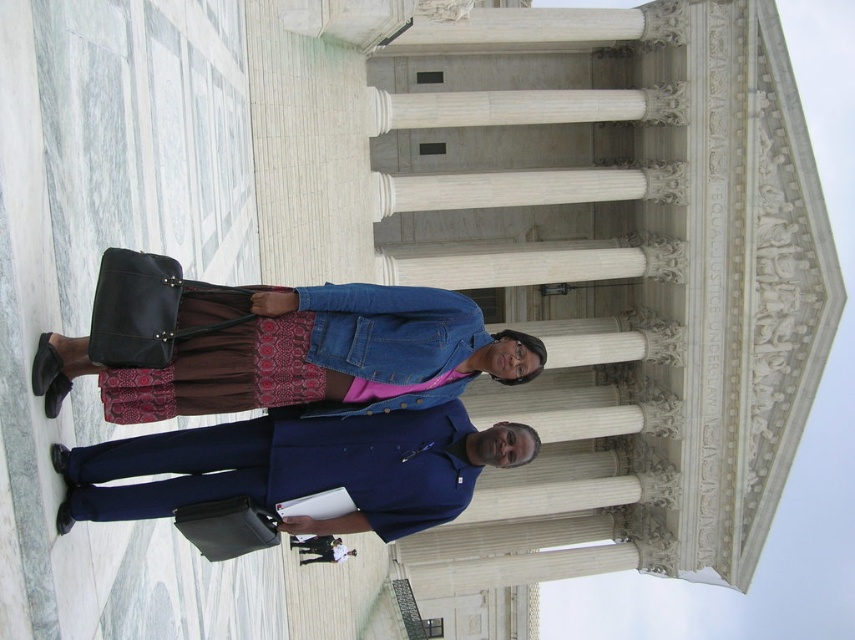
You are a photographer trying to capture a photo of the white marble columns at center and the denim jacket at center. Based on their positions, which object is located to the right of the other?

The white marble columns at center is positioned on the right side of denim jacket at center, so the white marble columns at center is to the right of the denim jacket at center.

You are a photographer trying to capture both the blue woolen suit at center and the dark blue shirt at center in a single frame. Which of the two clothing items will appear smaller in the photo?

The blue woolen suit at center will appear smaller in the photo because it occupies less space than the dark blue shirt at center.